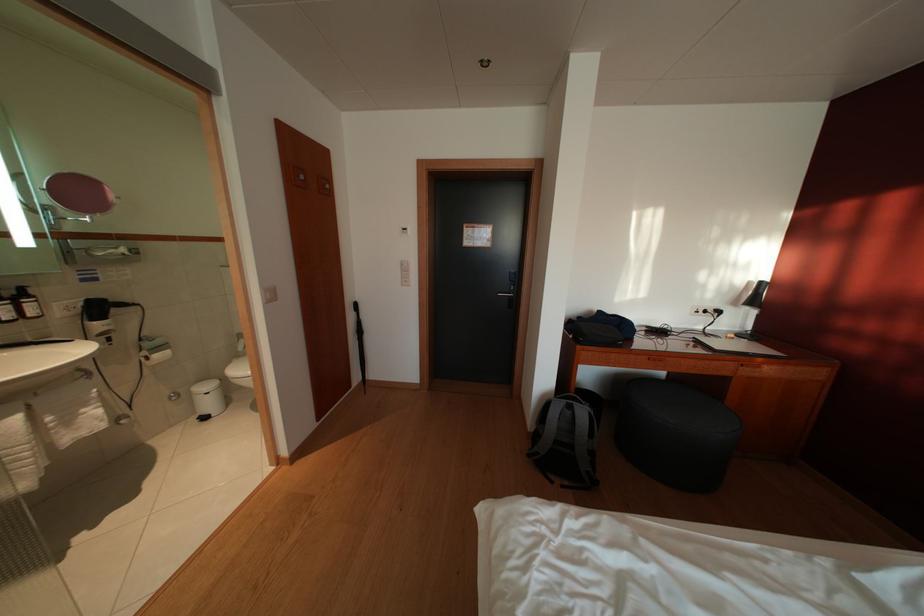
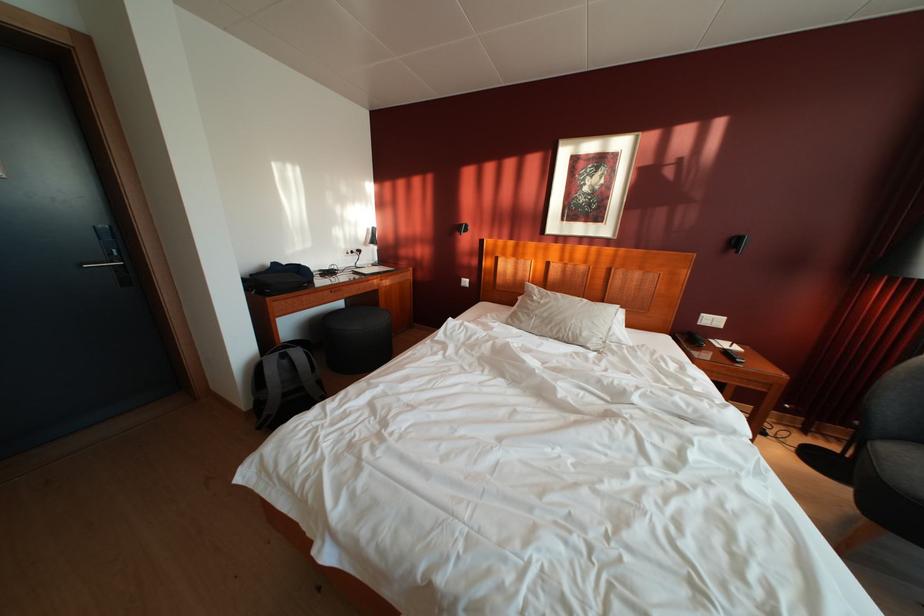
Locate, in the second image, the point that corresponds to pixel 578 413 in the first image.

(293, 362)